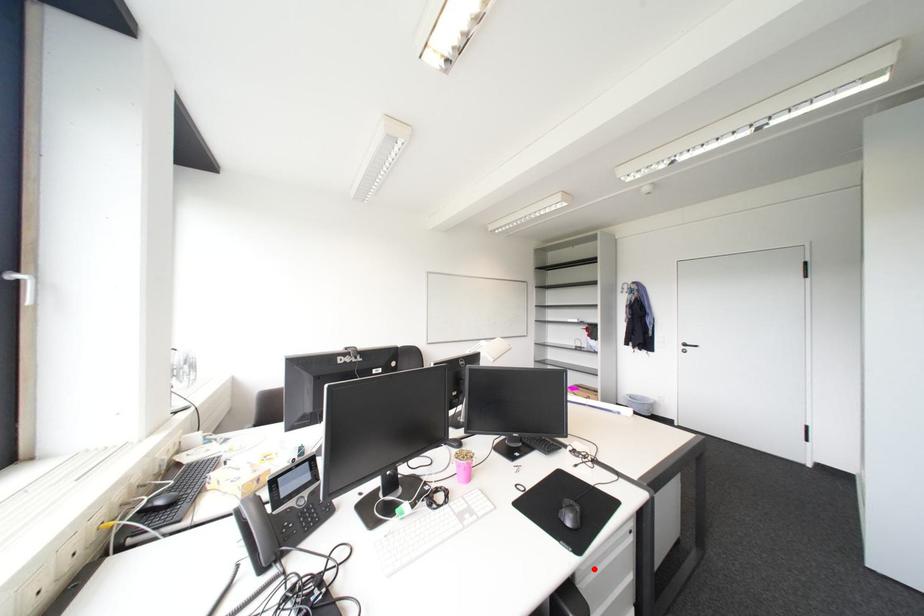
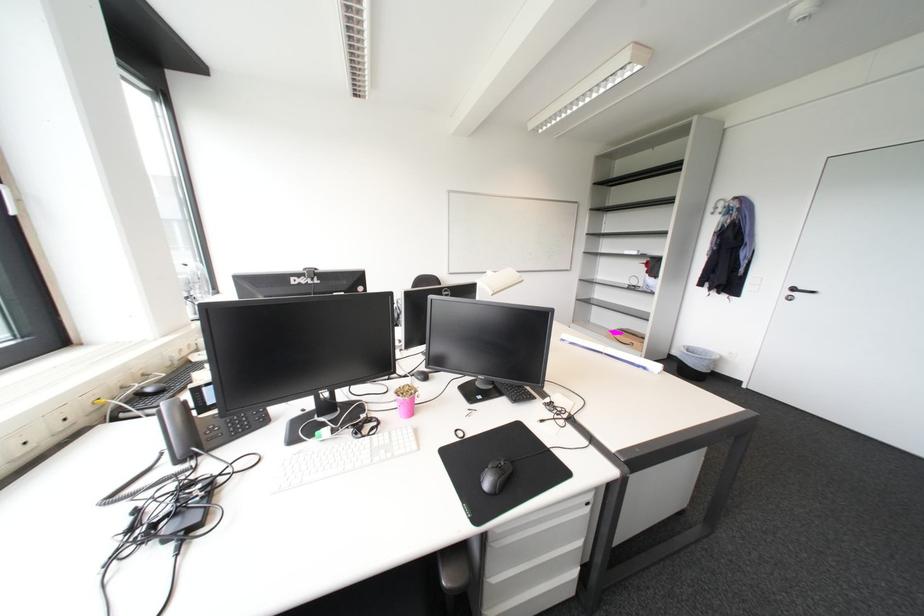
Locate, in the second image, the point that corresponds to the highlighted location in the first image.

(508, 532)